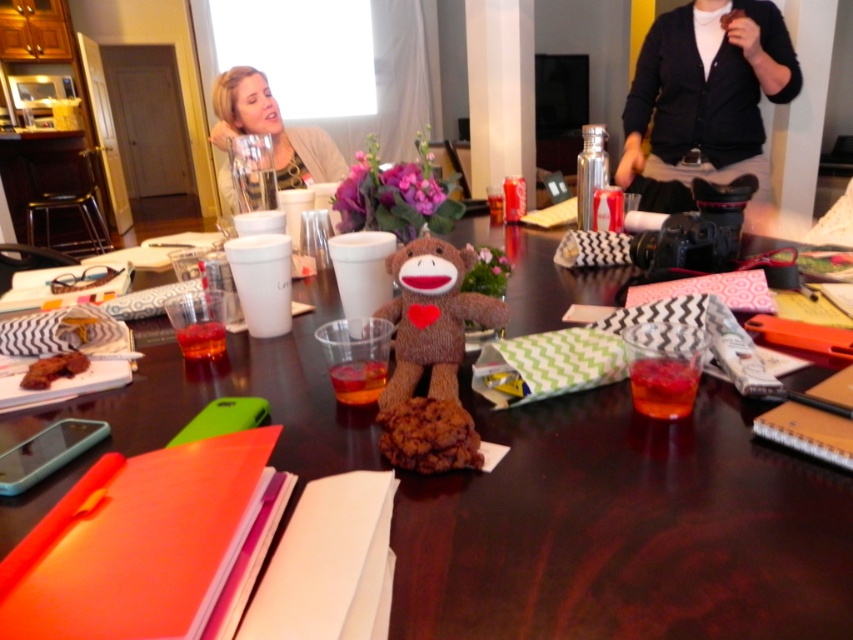
Does brown fabric table at center have a lesser width compared to baked chocolate cookie at center?

In fact, brown fabric table at center might be wider than baked chocolate cookie at center.

Does brown fabric table at center appear on the left side of baked chocolate cookie at center?

Incorrect, brown fabric table at center is not on the left side of baked chocolate cookie at center.

What do you see at coordinates (624, 529) in the screenshot? This screenshot has width=853, height=640. I see `brown fabric table at center` at bounding box center [624, 529].

Image resolution: width=853 pixels, height=640 pixels. Find the location of `brown fabric table at center`. brown fabric table at center is located at coordinates (624, 529).

Does brown fabric table at center have a greater width compared to matte beige sweater at upper left?

Indeed, brown fabric table at center has a greater width compared to matte beige sweater at upper left.

Is brown fabric table at center above matte beige sweater at upper left?

No, brown fabric table at center is not above matte beige sweater at upper left.

Which is in front, point (635, 476) or point (216, 115)?

Point (635, 476) is more forward.

Find the location of a particular element. Image resolution: width=853 pixels, height=640 pixels. brown fabric table at center is located at coordinates (624, 529).

Based on the photo, is matte beige sweater at upper left to the right of baked chocolate cookie at center from the viewer's perspective?

Incorrect, matte beige sweater at upper left is not on the right side of baked chocolate cookie at center.

Is matte beige sweater at upper left below baked chocolate cookie at center?

Incorrect, matte beige sweater at upper left is not positioned below baked chocolate cookie at center.

At what (x,y) coordinates should I click in order to perform the action: click on matte beige sweater at upper left. Please return your answer as a coordinate pair (x, y). The width and height of the screenshot is (853, 640). Looking at the image, I should click on (271, 129).